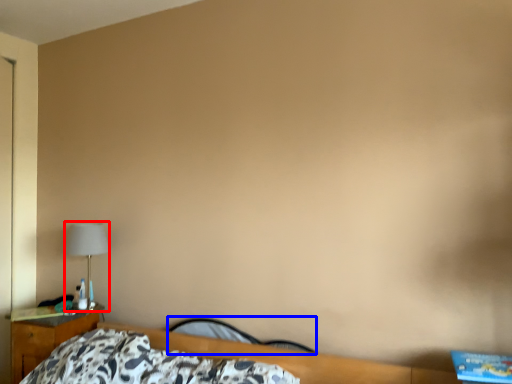
Question: Which object appears closest to the camera in this image, lamp (highlighted by a red box) or chair (highlighted by a blue box)?

Choices:
 (A) lamp
 (B) chair

Answer: (B)